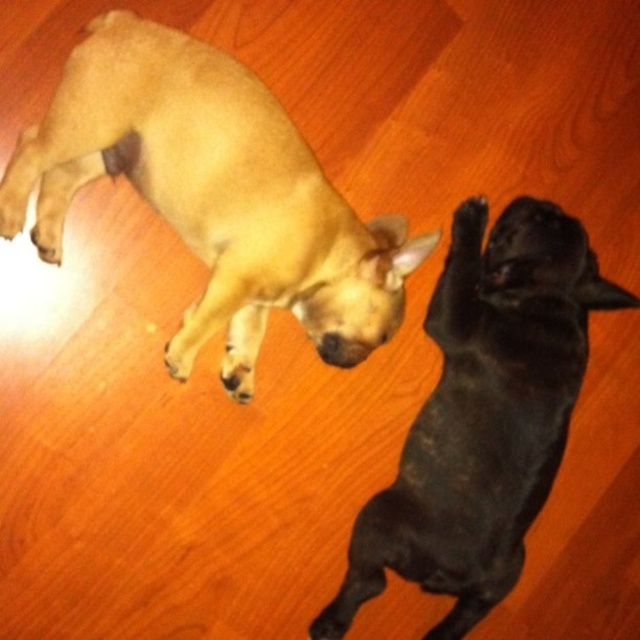
You are standing at the point marked by the coordinates point (68, 109). You want to move to the door located 1.5 meters away from your current position. Can you reach the door without moving more than 1.5 meters?

The distance between point (68, 109) and the viewer is 1.26 meters. Since the door is 1.5 meters away from your current position, you can reach it without exceeding the 1.5 meters limit.

You are a toy delivery robot that needs to place a small toy between the light brown fur dog at upper left and the black matte dog at upper right. The toy requires 15 inches of space to fit. Can you fit the toy between them?

The light brown fur dog at upper left and black matte dog at upper right are 14.67 inches apart. Since the required space is 15 inches, the toy cannot be placed between them.

You are standing at the origin point in the image. You want to walk to the light brown fur dog at upper left. What are the coordinates you need to move to?

The coordinates for the light brown fur dog at upper left are at point (212, 195).